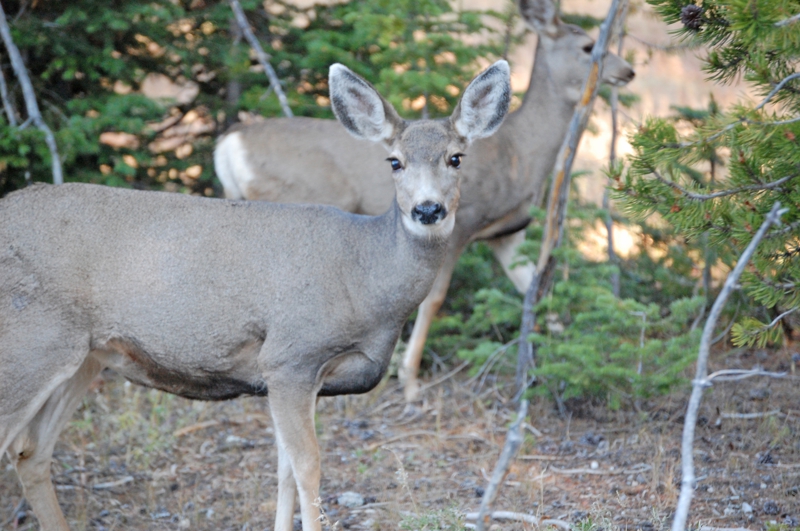
At what (x,y) coordinates should I click in order to perform the action: click on bare wood. Please return your answer as a coordinate pair (x, y). Looking at the image, I should click on (546, 222), (596, 85).